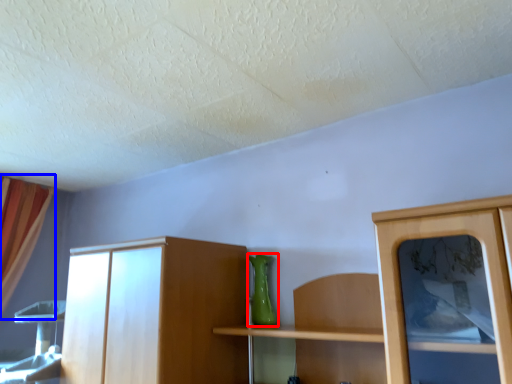
Question: Which of the following is the closest to the observer, vase (highlighted by a red box) or curtain (highlighted by a blue box)?

Choices:
 (A) vase
 (B) curtain

Answer: (A)